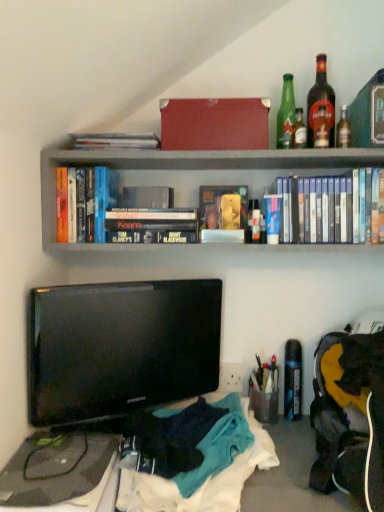
Where is `vacant space situated on the left part of green glass bottle at upper right, which is counted as the third bottle, starting from the right`? vacant space situated on the left part of green glass bottle at upper right, which is counted as the third bottle, starting from the right is located at coordinates (221, 158).